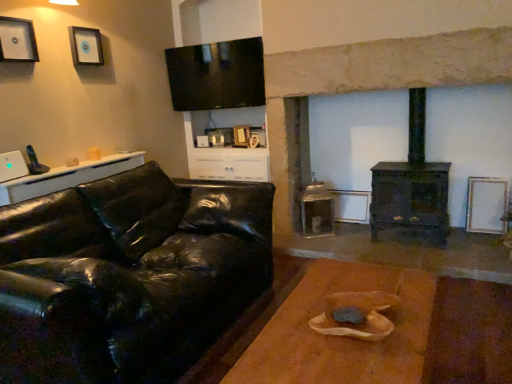
In order to click on empty space that is ontop of brown wooden table at center, the first table in the right-to-left sequence (from a real-world perspective) in this screenshot , I will do `click(345, 335)`.